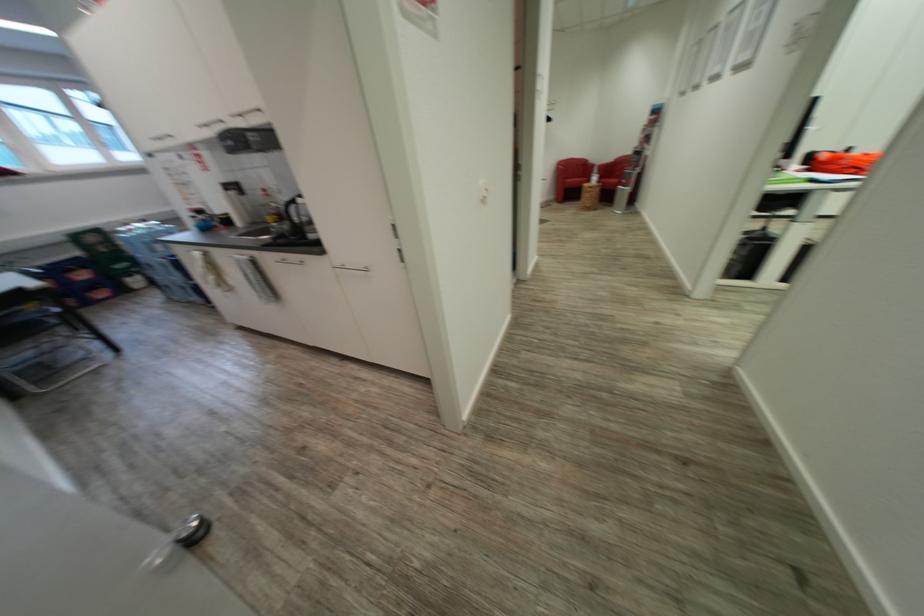
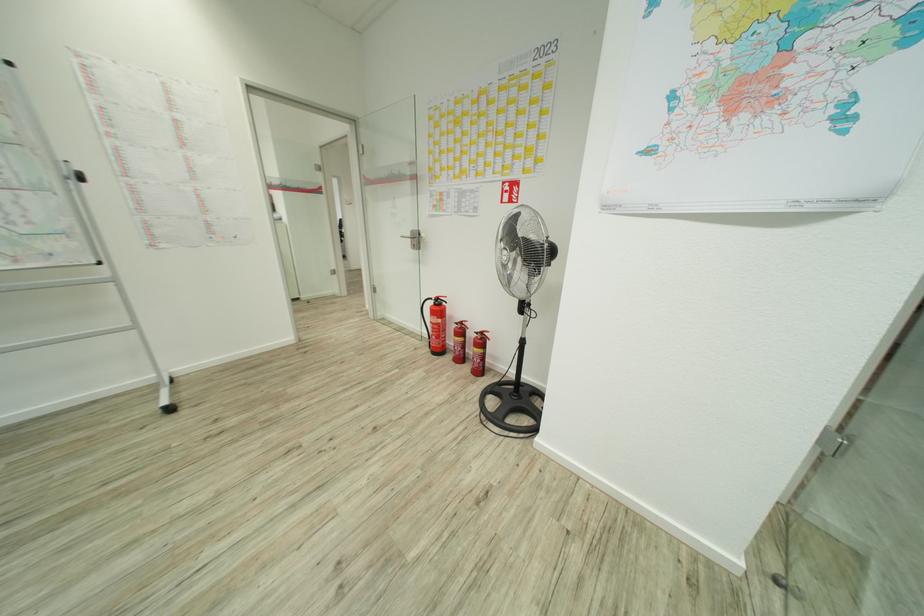
Question: I am providing you with two images of the same scene from different viewpoints. After the viewpoint changes to image2, which objects are now occluded?

Choices:
 (A) whiteboard stand wheel
 (B) silver door handle
 (C) black kettle handle
 (D) black and orange flashlight

Answer: (C)